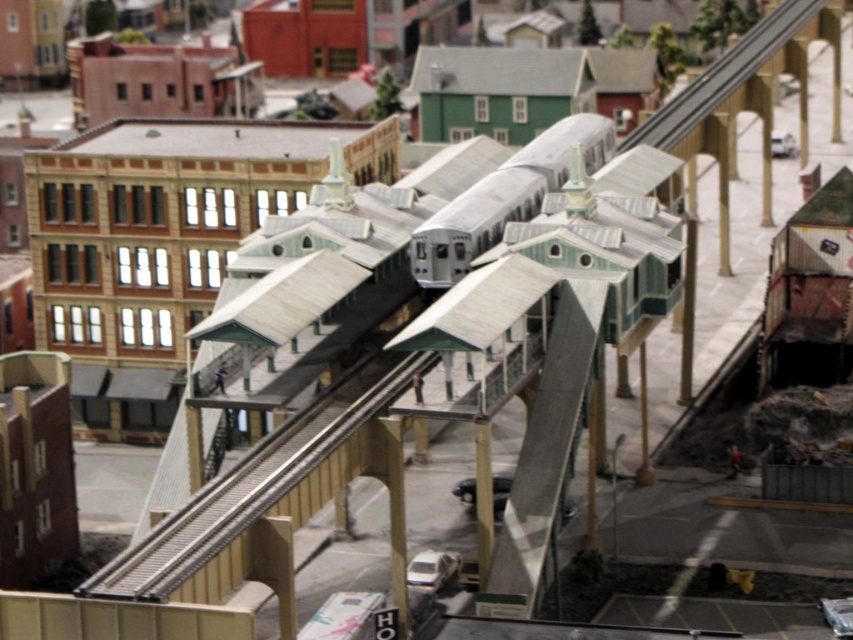
Question: Which object is farther from the camera taking this photo?

Choices:
 (A) silver metallic train at center
 (B) metallic silver train track at center

Answer: (A)

Question: Which point is farther to the camera?

Choices:
 (A) silver metallic train at center
 (B) metallic silver train track at center

Answer: (A)

Question: In this image, where is metallic silver train track at center located relative to silver metallic train at center?

Choices:
 (A) below
 (B) above

Answer: (A)

Question: Does metallic silver train track at center have a larger size compared to silver metallic train at center?

Choices:
 (A) yes
 (B) no

Answer: (B)

Question: Does metallic silver train track at center appear on the right side of silver metallic train at center?

Choices:
 (A) yes
 (B) no

Answer: (B)